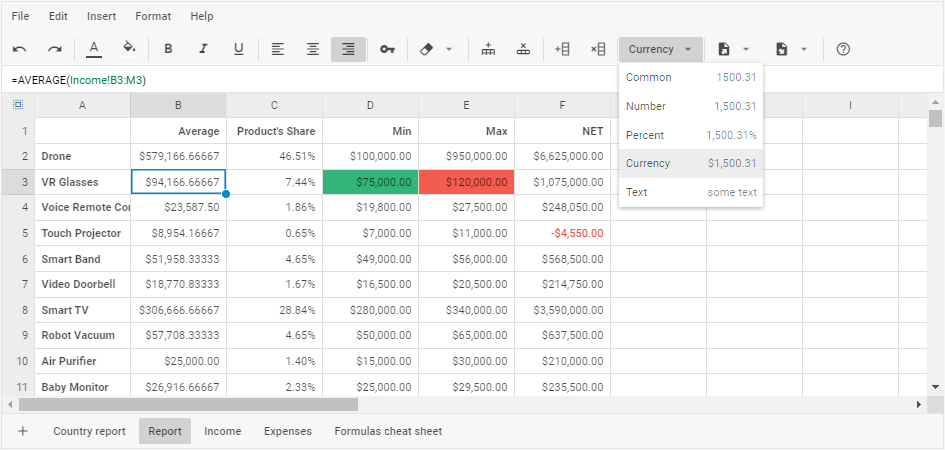
This screenshot has width=945, height=450. I want to click on columns, so click(110, 104), click(201, 105), click(296, 101), click(382, 105), click(455, 104), click(572, 102), click(779, 101), click(849, 100), click(909, 104).